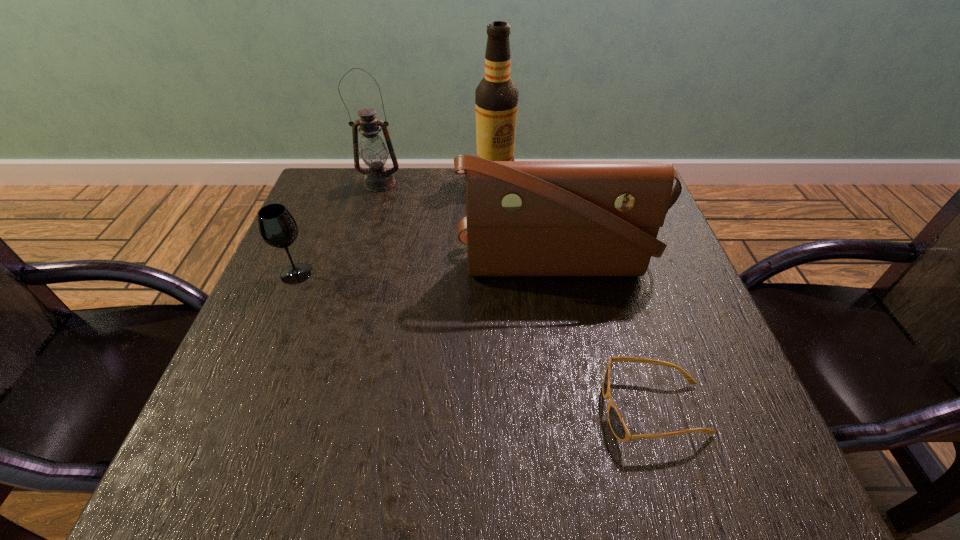
Identify the location of sunglasses located in the right edge section of the desktop. (618, 427).

Locate an element on the screen. object present at the far left corner is located at coordinates (373, 151).

You are a GUI agent. You are given a task and a screenshot of the screen. Output one action in this format:
    pyautogui.click(x=<x>, y=<y>)
    Task: Click on the object located in the near right corner section of the desktop
    
    Given the screenshot: What is the action you would take?
    pyautogui.click(x=618, y=427)

Where is `vacant space at the far edge of the desktop`? vacant space at the far edge of the desktop is located at coordinates (445, 218).

The height and width of the screenshot is (540, 960). I want to click on vacant space at the near edge, so click(438, 431).

The width and height of the screenshot is (960, 540). I want to click on vacant area at the left edge, so click(x=300, y=330).

This screenshot has height=540, width=960. Find the location of `vacant point at the right edge`. vacant point at the right edge is located at coordinates (657, 404).

In the image, there is a desktop. Find the location of `free space at the far left corner`. free space at the far left corner is located at coordinates (358, 185).

In the image, there is a desktop. At what (x,y) coordinates should I click in order to perform the action: click on vacant region at the near left corner. Please return your answer as a coordinate pair (x, y). Looking at the image, I should click on (274, 473).

Where is `unoccupied position between the alcohol and the nearest object`? The image size is (960, 540). unoccupied position between the alcohol and the nearest object is located at coordinates (574, 293).